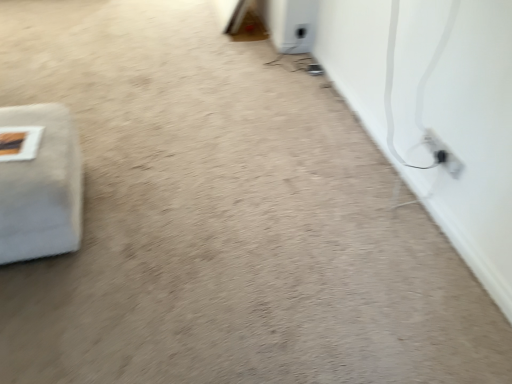
Question: Does white fabric at left appear on the right side of black plastic electric outlet at lower right?

Choices:
 (A) no
 (B) yes

Answer: (A)

Question: Would you say black plastic electric outlet at lower right is part of white fabric at left's contents?

Choices:
 (A) no
 (B) yes

Answer: (A)

Question: Is white fabric at left positioned with its back to black plastic electric outlet at lower right?

Choices:
 (A) no
 (B) yes

Answer: (A)

Question: Considering the relative sizes of white fabric at left and black plastic electric outlet at lower right in the image provided, is white fabric at left wider than black plastic electric outlet at lower right?

Choices:
 (A) no
 (B) yes

Answer: (B)

Question: Can you see white fabric at left touching black plastic electric outlet at lower right?

Choices:
 (A) no
 (B) yes

Answer: (A)

Question: Considering the relative sizes of white fabric at left and black plastic electric outlet at lower right in the image provided, is white fabric at left taller than black plastic electric outlet at lower right?

Choices:
 (A) no
 (B) yes

Answer: (B)

Question: Can you confirm if black plastic electric outlet at lower right is taller than white fabric at left?

Choices:
 (A) no
 (B) yes

Answer: (A)

Question: From the image's perspective, is black plastic electric outlet at lower right located beneath white fabric at left?

Choices:
 (A) no
 (B) yes

Answer: (A)

Question: Is the depth of black plastic electric outlet at lower right less than that of white fabric at left?

Choices:
 (A) no
 (B) yes

Answer: (A)

Question: Does black plastic electric outlet at lower right touch white fabric at left?

Choices:
 (A) no
 (B) yes

Answer: (A)

Question: Is black plastic electric outlet at lower right oriented away from white fabric at left?

Choices:
 (A) yes
 (B) no

Answer: (B)

Question: Is black plastic electric outlet at lower right outside white fabric at left?

Choices:
 (A) no
 (B) yes

Answer: (B)

Question: In the image, is white fabric at left positioned in front of or behind black plastic electric outlet at lower right?

Choices:
 (A) front
 (B) behind

Answer: (A)